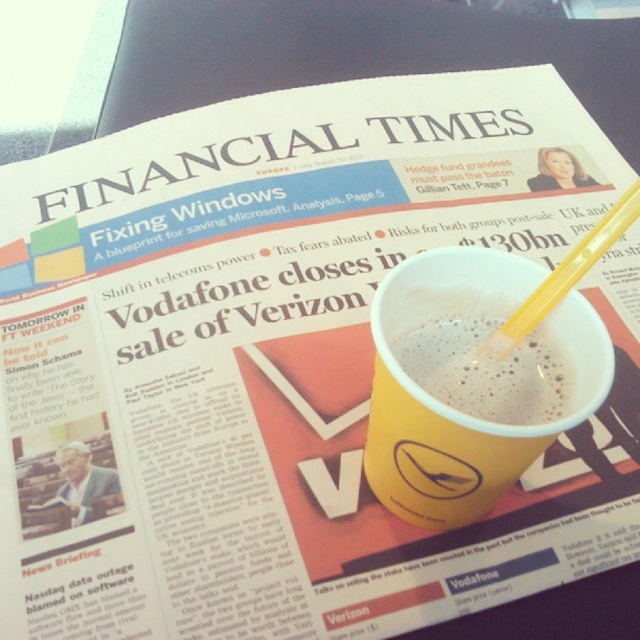
Question: In this image, where is yellow paper cup at center located relative to white frothy coffee at center?

Choices:
 (A) right
 (B) left

Answer: (B)

Question: Which of the following is the farthest from the observer?

Choices:
 (A) 564,408
 (B) 506,321

Answer: (B)

Question: Among these points, which one is nearest to the camera?

Choices:
 (A) (490, 372)
 (B) (404, 518)

Answer: (A)

Question: Can you confirm if yellow paper cup at center is wider than yellow plastic straw at upper right?

Choices:
 (A) yes
 (B) no

Answer: (A)

Question: Does yellow paper cup at center lie in front of white frothy coffee at center?

Choices:
 (A) yes
 (B) no

Answer: (A)

Question: Which of the following is the farthest from the observer?

Choices:
 (A) yellow paper cup at center
 (B) white frothy coffee at center
 (C) yellow plastic straw at upper right

Answer: (B)